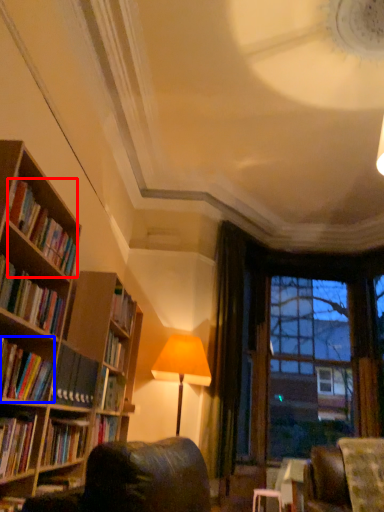
Question: Which object is closer to the camera taking this photo, book (highlighted by a red box) or book (highlighted by a blue box)?

Choices:
 (A) book
 (B) book

Answer: (B)